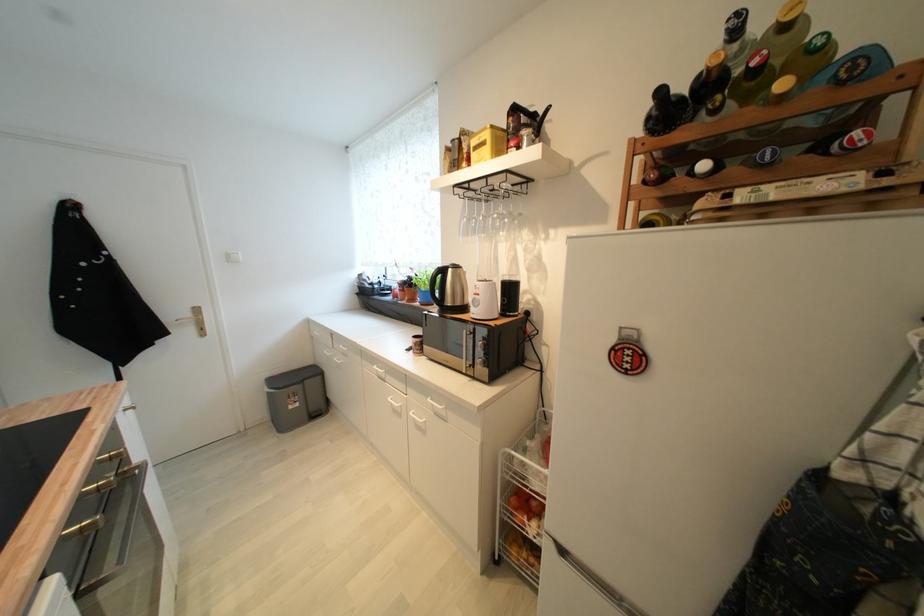
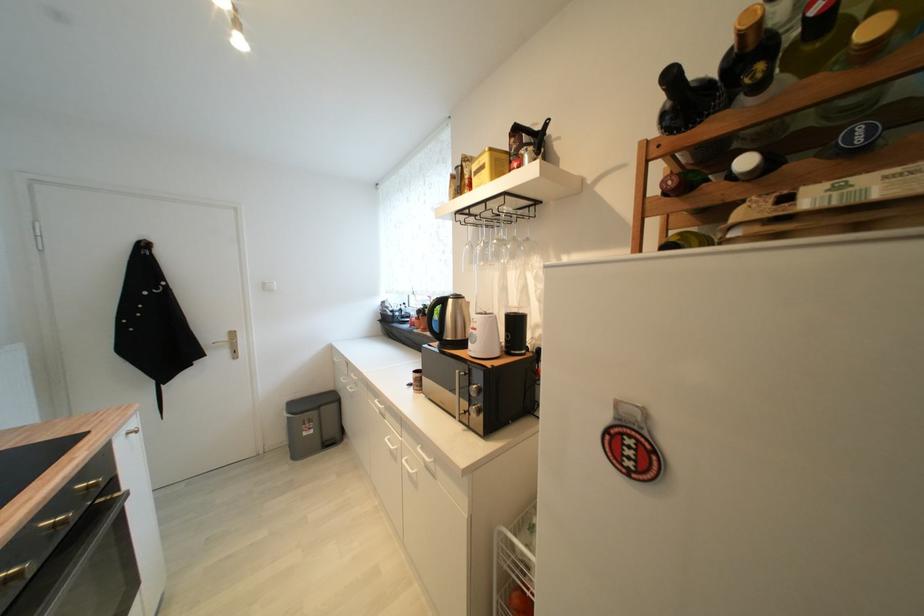
Find the pixel in the second image that matches point (516, 121) in the first image.

(517, 142)